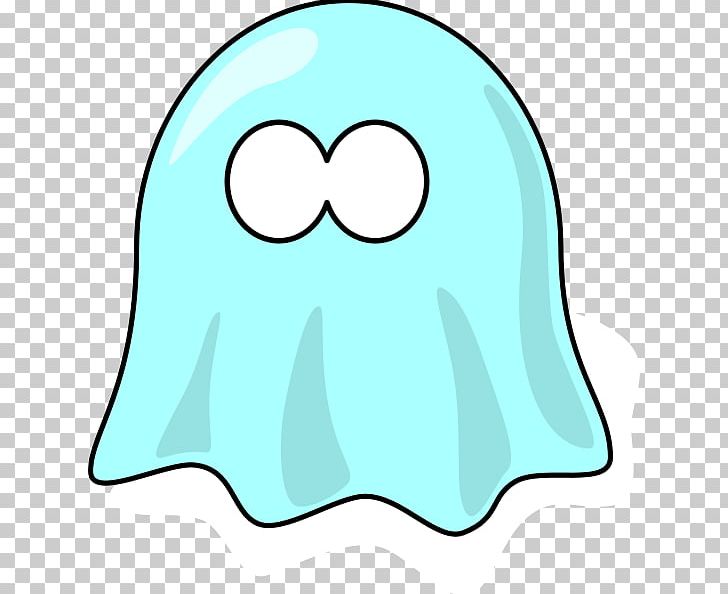
In order to click on dark shadows within folds of sheet in this screenshot , I will do `click(191, 418)`, `click(309, 428)`, `click(488, 419)`, `click(544, 380)`.